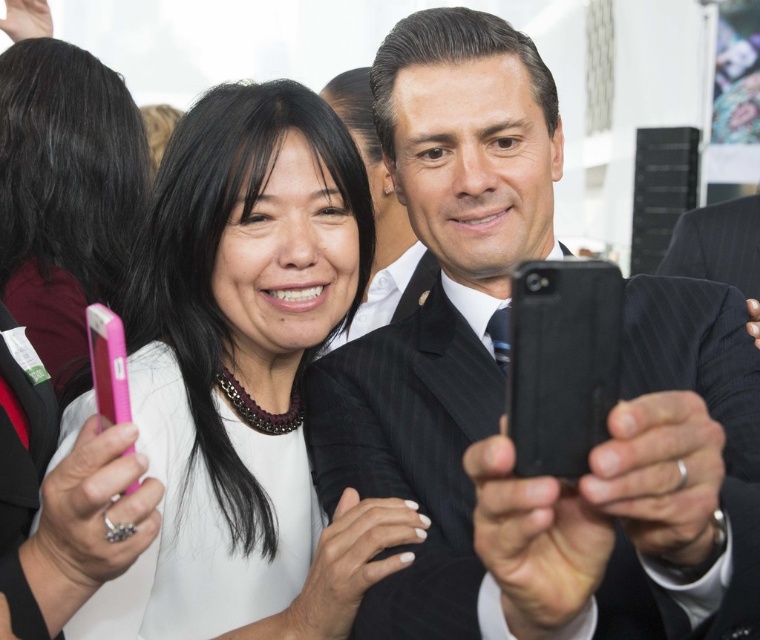
Question: Among these objects, which one is nearest to the camera?

Choices:
 (A) pink plastic phone at left
 (B) white matte dress at center
 (C) matte black suit at center

Answer: (C)

Question: Does white matte dress at center lie behind pink plastic phone at left?

Choices:
 (A) no
 (B) yes

Answer: (A)

Question: Can you confirm if matte black suit at center is thinner than pink plastic phone at left?

Choices:
 (A) no
 (B) yes

Answer: (A)

Question: Is white matte dress at center smaller than pink plastic phone at left?

Choices:
 (A) no
 (B) yes

Answer: (A)

Question: Among these objects, which one is nearest to the camera?

Choices:
 (A) matte black suit at center
 (B) white matte dress at center
 (C) pink plastic phone at left

Answer: (A)

Question: Based on their relative distances, which object is farther from the pink plastic phone at left?

Choices:
 (A) matte black suit at center
 (B) white matte dress at center

Answer: (A)